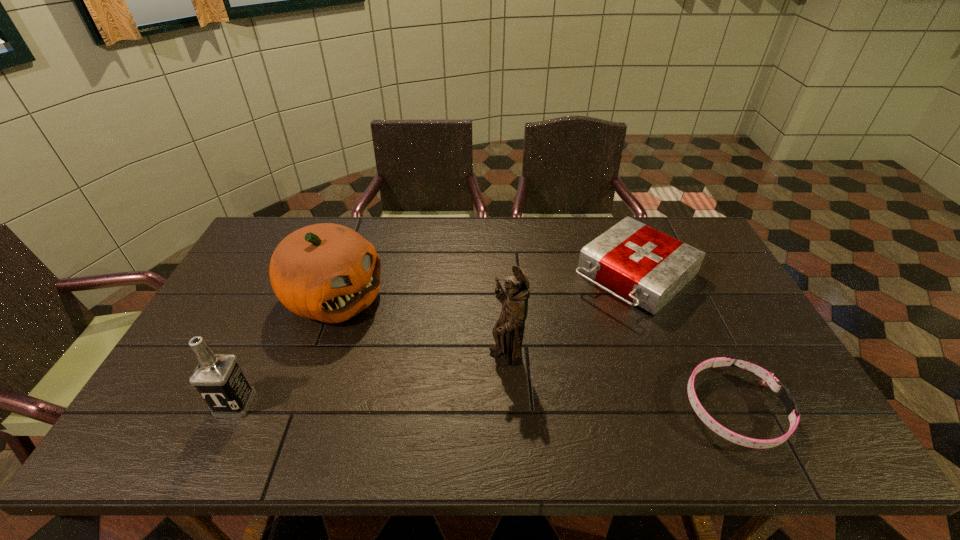
At what (x,y) coordinates should I click in order to perform the action: click on free location that satisfies the following two spatial constraints: 1. on the front label of the vodka; 2. with the buckle on the dog collar. Please return your answer as a coordinate pair (x, y). The height and width of the screenshot is (540, 960). Looking at the image, I should click on tap(233, 408).

Where is `free location that satisfies the following two spatial constraints: 1. on the front side of the dog collar; 2. with the buckle on the pumpkin`? free location that satisfies the following two spatial constraints: 1. on the front side of the dog collar; 2. with the buckle on the pumpkin is located at coordinates (295, 408).

Where is `free space that satisfies the following two spatial constraints: 1. on the front label of the dog collar; 2. with the buckle on the vodka`? free space that satisfies the following two spatial constraints: 1. on the front label of the dog collar; 2. with the buckle on the vodka is located at coordinates (233, 408).